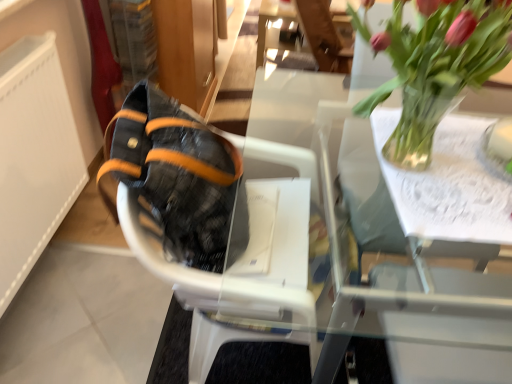
Looking at this image, measure the distance between point (x=197, y=151) and camera.

Point (x=197, y=151) is 86.50 centimeters from camera.

Identify the location of black textured fabric baby carriage at center. (x=224, y=228).

The height and width of the screenshot is (384, 512). Describe the element at coordinates (437, 324) in the screenshot. I see `transparent glass table at upper center` at that location.

You are a GUI agent. You are given a task and a screenshot of the screen. Output one action in this format:
    pyautogui.click(x=<x>, y=<y>)
    Task: Click on the leather-like black shoe at left
    The height and width of the screenshot is (384, 512).
    Given the screenshot: What is the action you would take?
    pyautogui.click(x=175, y=174)

Which is in front, white textured radiator at left or translucent glass vase at upper right?

translucent glass vase at upper right is more forward.

Does white textured radiator at left appear on the left side of translucent glass vase at upper right?

Yes.

Can you tell me how much white textured radiator at left and translucent glass vase at upper right differ in facing direction?

1.26 degrees.

Identify the location of houseplant in front of the white textured radiator at left. The height and width of the screenshot is (384, 512). (435, 66).

Which object is thinner, leather-like black shoe at left or translucent glass vase at upper right?

With smaller width is leather-like black shoe at left.

Are leather-like black shoe at left and translucent glass vase at upper right located far from each other?

That's not correct — leather-like black shoe at left is a little close to translucent glass vase at upper right.

How many degrees apart are the facing directions of leather-like black shoe at left and translucent glass vase at upper right?

The facing directions of leather-like black shoe at left and translucent glass vase at upper right are 7.74 degrees apart.

Which of these two, leather-like black shoe at left or translucent glass vase at upper right, is bigger?

Bigger between the two is translucent glass vase at upper right.

Considering the relative positions of black textured fabric baby carriage at center and translucent glass vase at upper right in the image provided, is black textured fabric baby carriage at center in front of translucent glass vase at upper right?

No, it is not.

How far apart are black textured fabric baby carriage at center and translucent glass vase at upper right?

The distance of black textured fabric baby carriage at center from translucent glass vase at upper right is 17.09 inches.

Which object is positioned more to the left, black textured fabric baby carriage at center or translucent glass vase at upper right?

From the viewer's perspective, black textured fabric baby carriage at center appears more on the left side.

Looking at this image, are black textured fabric baby carriage at center and translucent glass vase at upper right making contact?

black textured fabric baby carriage at center and translucent glass vase at upper right are clearly separated.

Is leather-like black shoe at left not close to white textured radiator at left?

No, leather-like black shoe at left is not far away from white textured radiator at left.

Is leather-like black shoe at left oriented away from white textured radiator at left?

Yes.

Considering the relative positions of leather-like black shoe at left and white textured radiator at left in the image provided, is leather-like black shoe at left in front of white textured radiator at left?

Yes.

Looking at the image, does leather-like black shoe at left seem bigger or smaller compared to white textured radiator at left?

In the image, leather-like black shoe at left appears to be smaller than white textured radiator at left.

The width and height of the screenshot is (512, 384). Identify the location of table below the translucent glass vase at upper right (from a real-world perspective). (437, 324).

From a real-world perspective, is translucent glass vase at upper right below transparent glass table at upper center?

No, from a real-world perspective, translucent glass vase at upper right is not beneath transparent glass table at upper center.

Considering their positions, is translucent glass vase at upper right located in front of or behind transparent glass table at upper center?

Clearly, translucent glass vase at upper right is in front of transparent glass table at upper center.

Looking at this image, is translucent glass vase at upper right looking in the opposite direction of transparent glass table at upper center?

No, translucent glass vase at upper right is not facing away from transparent glass table at upper center.

Is white textured radiator at left located within transparent glass table at upper center?

Definitely not — white textured radiator at left is not inside transparent glass table at upper center.

In the image, is transparent glass table at upper center positioned in front of or behind white textured radiator at left?

Clearly, transparent glass table at upper center is in front of white textured radiator at left.

Can you see transparent glass table at upper center touching white textured radiator at left?

transparent glass table at upper center and white textured radiator at left are not in contact.

Can you confirm if transparent glass table at upper center is wider than white textured radiator at left?

Indeed, transparent glass table at upper center has a greater width compared to white textured radiator at left.

Between translucent glass vase at upper right and black textured fabric baby carriage at center, which one has smaller width?

With smaller width is translucent glass vase at upper right.

Is translucent glass vase at upper right with black textured fabric baby carriage at center?

They are not placed beside each other.

The image size is (512, 384). What are the coordinates of `houseplant positioned vertically above the black textured fabric baby carriage at center (from a real-world perspective)` in the screenshot? It's located at (435, 66).

Is translucent glass vase at upper right looking in the opposite direction of black textured fabric baby carriage at center?

No, black textured fabric baby carriage at center is not at the back of translucent glass vase at upper right.

The width and height of the screenshot is (512, 384). Identify the location of radiator below the translucent glass vase at upper right (from a real-world perspective). (34, 156).

The image size is (512, 384). Identify the location of houseplant that is on the right side of leather-like black shoe at left. (435, 66).

When comparing their distances from leather-like black shoe at left, does transparent glass table at upper center or white textured radiator at left seem closer?

Based on the image, transparent glass table at upper center appears to be nearer to leather-like black shoe at left.

When comparing their distances from black textured fabric baby carriage at center, does white textured radiator at left or leather-like black shoe at left seem closer?

Based on the image, leather-like black shoe at left appears to be nearer to black textured fabric baby carriage at center.

Based on their spatial positions, is black textured fabric baby carriage at center or translucent glass vase at upper right closer to transparent glass table at upper center?

black textured fabric baby carriage at center.

Which object lies further to the anchor point white textured radiator at left, translucent glass vase at upper right or leather-like black shoe at left?

Based on the image, translucent glass vase at upper right appears to be further to white textured radiator at left.

Considering their positions, is transparent glass table at upper center positioned closer to black textured fabric baby carriage at center than white textured radiator at left?

transparent glass table at upper center lies closer to black textured fabric baby carriage at center than the other object.

Estimate the real-world distances between objects in this image. Which object is further from leather-like black shoe at left, black textured fabric baby carriage at center or translucent glass vase at upper right?

translucent glass vase at upper right.

Based on their spatial positions, is translucent glass vase at upper right or black textured fabric baby carriage at center closer to transparent glass table at upper center?

The object closer to transparent glass table at upper center is black textured fabric baby carriage at center.

Looking at the image, which one is located closer to transparent glass table at upper center, translucent glass vase at upper right or white textured radiator at left?

translucent glass vase at upper right is closer to transparent glass table at upper center.

Image resolution: width=512 pixels, height=384 pixels. In order to click on baby carriage situated between white textured radiator at left and translucent glass vase at upper right from left to right in this screenshot , I will do `click(224, 228)`.

Locate an element on the screen. This screenshot has width=512, height=384. houseplant between white textured radiator at left and transparent glass table at upper center in the horizontal direction is located at coordinates (435, 66).

Image resolution: width=512 pixels, height=384 pixels. I want to click on baby carriage between leather-like black shoe at left and translucent glass vase at upper right, so coord(224,228).

Find the location of `footwear between white textured radiator at left and translucent glass vase at upper right in the horizontal direction`. footwear between white textured radiator at left and translucent glass vase at upper right in the horizontal direction is located at coordinates (175, 174).